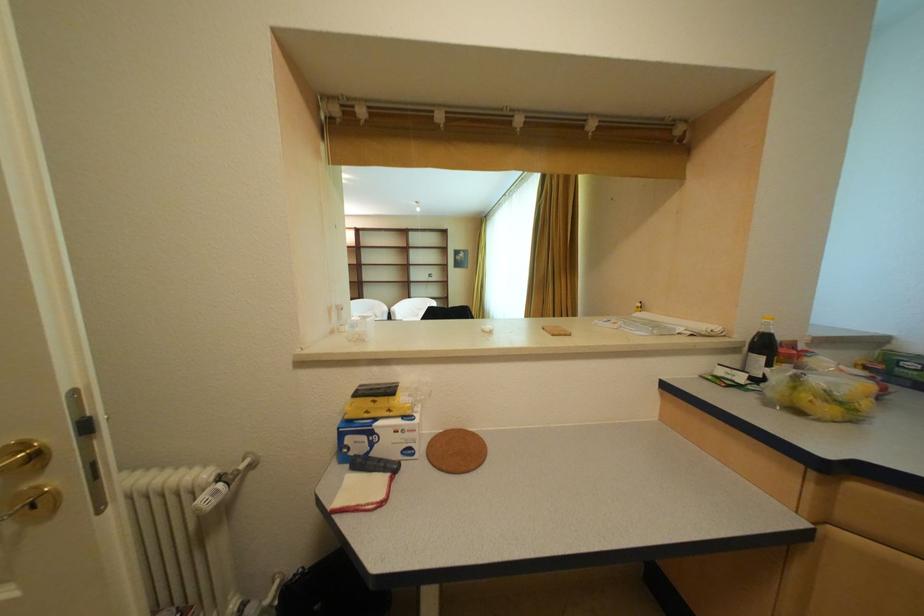
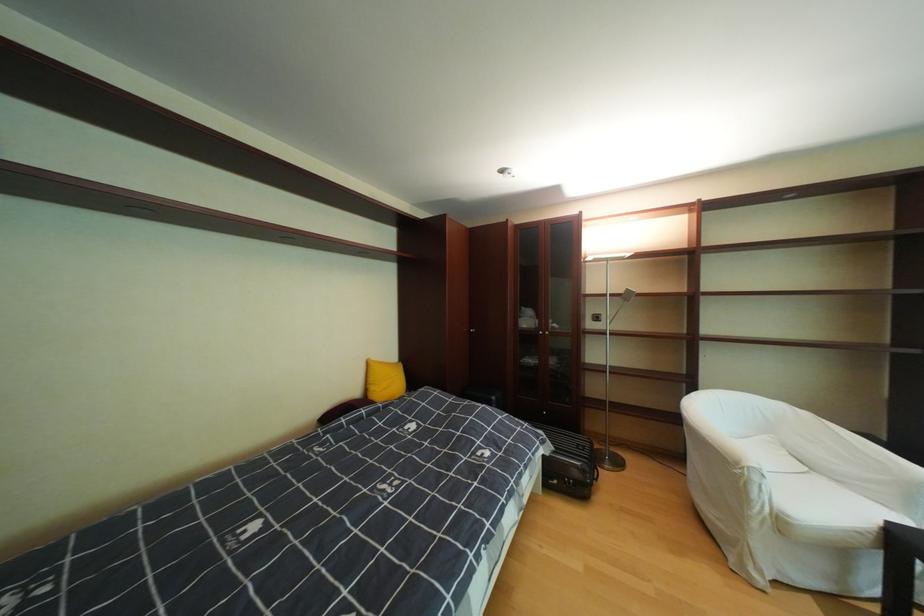
Find the pixel in the second image that matches point 388,302 in the first image.

(793, 407)